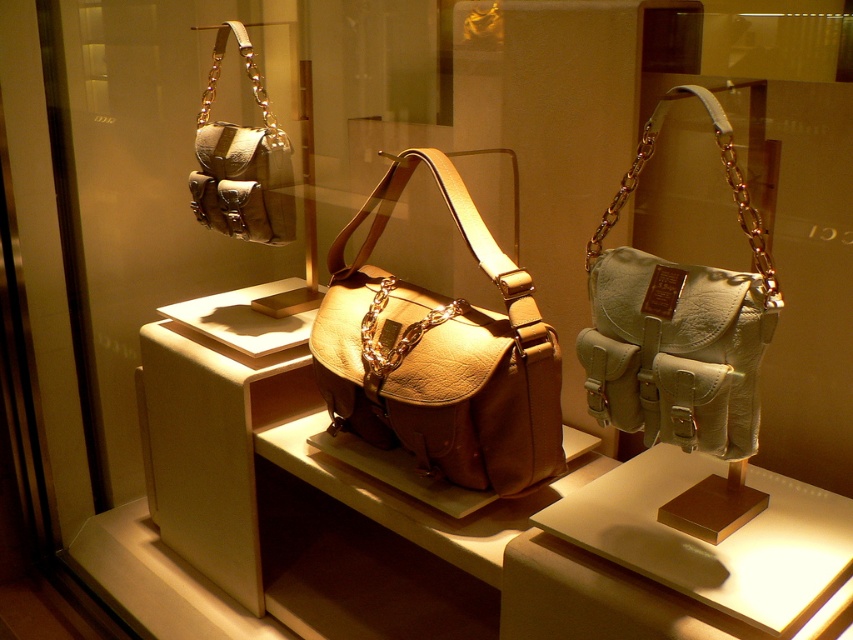
Does point (480, 362) lie behind point (666, 342)?

Yes, point (480, 362) is farther from viewer.

Which of these two, leather bag at center or light beige leather handbag at right, stands taller?

Standing taller between the two is leather bag at center.

Locate an element on the screen. leather bag at center is located at coordinates (440, 355).

Identify the location of leather bag at center. (440, 355).

Does light beige leather handbag at right have a smaller size compared to matte brown leather handbag at upper left?

No.

Is point (601, 241) positioned in front of point (206, 225)?

That is True.

Which is behind, point (647, 122) or point (198, 188)?

The point (198, 188) is more distant.

Where is `light beige leather handbag at right`? The image size is (853, 640). light beige leather handbag at right is located at coordinates (679, 323).

Between point (434, 472) and point (233, 124), which one is positioned behind?

Point (233, 124)

Who is positioned more to the right, leather bag at center or matte brown leather handbag at upper left?

leather bag at center is more to the right.

This screenshot has height=640, width=853. Describe the element at coordinates (440, 355) in the screenshot. I see `leather bag at center` at that location.

This screenshot has width=853, height=640. I want to click on leather bag at center, so click(440, 355).